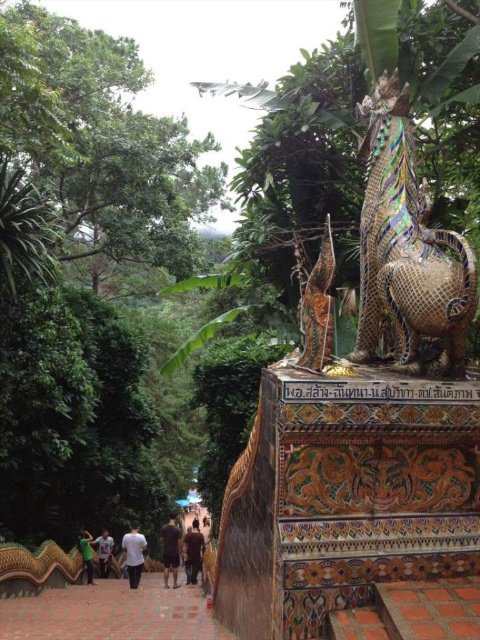
Looking at this image, can you confirm if terracotta tile path at lower center is shorter than dark green fabric at lower left?

No, terracotta tile path at lower center is not shorter than dark green fabric at lower left.

Can you confirm if terracotta tile path at lower center is positioned to the left of dark green fabric at lower left?

No, terracotta tile path at lower center is not to the left of dark green fabric at lower left.

Which is behind, point (148, 593) or point (82, 541)?

The point (82, 541) is more distant.

Find the location of a particular element. terracotta tile path at lower center is located at coordinates (110, 612).

Is dark brown cotton shirt at center behind brown leather jacket at center?

No, it is in front of brown leather jacket at center.

Is point (176, 525) behind point (191, 573)?

No, it is in front of (191, 573).

Does point (171, 540) come farther from viewer compared to point (196, 573)?

No, (171, 540) is in front of (196, 573).

Where is `dark brown cotton shirt at center`? The width and height of the screenshot is (480, 640). dark brown cotton shirt at center is located at coordinates pyautogui.click(x=170, y=548).

Between terracotta tile path at lower center and brown leather jacket at center, which one has more height?

terracotta tile path at lower center

Is terracotta tile path at lower center smaller than brown leather jacket at center?

Incorrect, terracotta tile path at lower center is not smaller in size than brown leather jacket at center.

Identify the location of terracotta tile path at lower center. (110, 612).